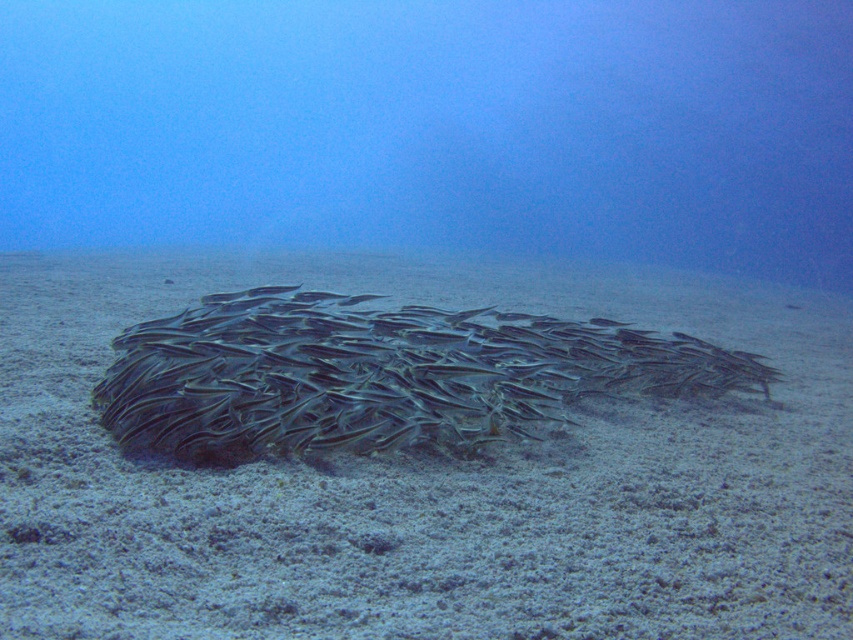
Question: Is gray sandy bottom at center wider than silvery metallic fish at center?

Choices:
 (A) yes
 (B) no

Answer: (B)

Question: Which object is farther from the camera taking this photo?

Choices:
 (A) silvery metallic fish at center
 (B) gray sandy bottom at center

Answer: (B)

Question: Can you confirm if gray sandy bottom at center is wider than silvery metallic fish at center?

Choices:
 (A) no
 (B) yes

Answer: (A)

Question: Does gray sandy bottom at center have a smaller size compared to silvery metallic fish at center?

Choices:
 (A) yes
 (B) no

Answer: (A)

Question: Among these points, which one is nearest to the camera?

Choices:
 (A) (553, 496)
 (B) (181, 432)

Answer: (A)